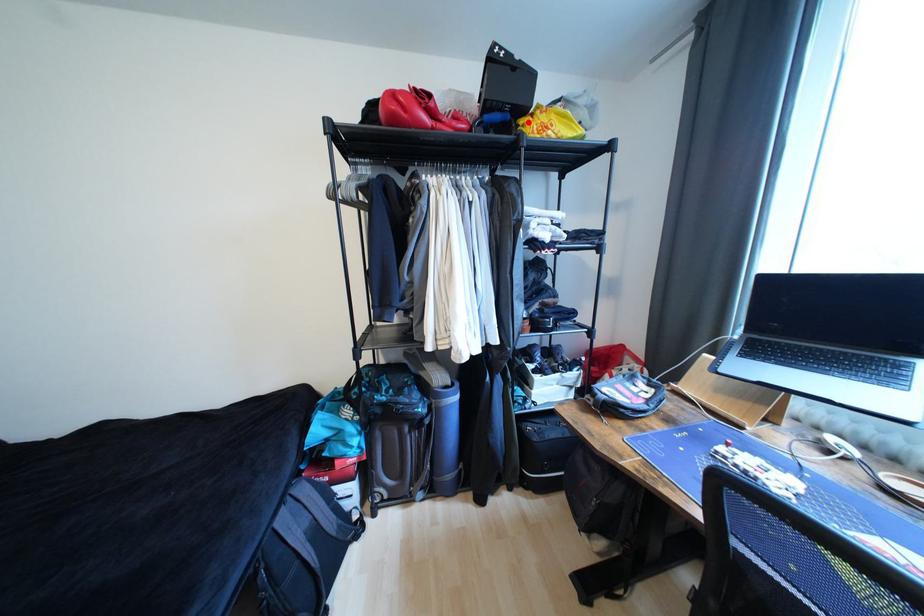
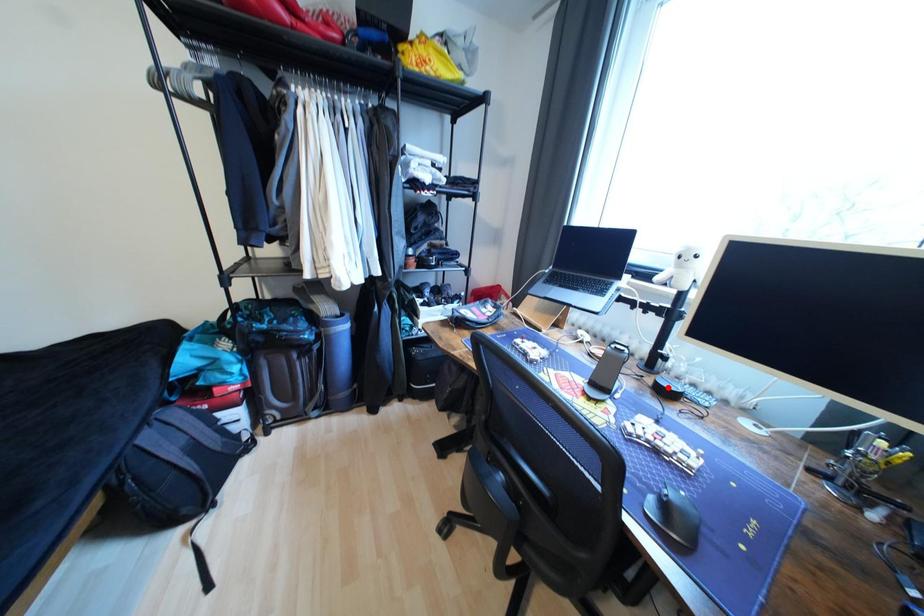
I am providing you with two images of the same scene from different viewpoints. A red point is marked on the first image and another point is marked on the second image. Is the marked point in image1 the same physical position as the marked point in image2?

No